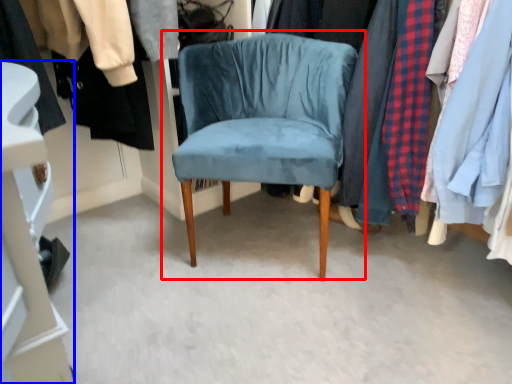
Question: Which object appears farthest to the camera in this image, chair (highlighted by a red box) or closet (highlighted by a blue box)?

Choices:
 (A) chair
 (B) closet

Answer: (B)